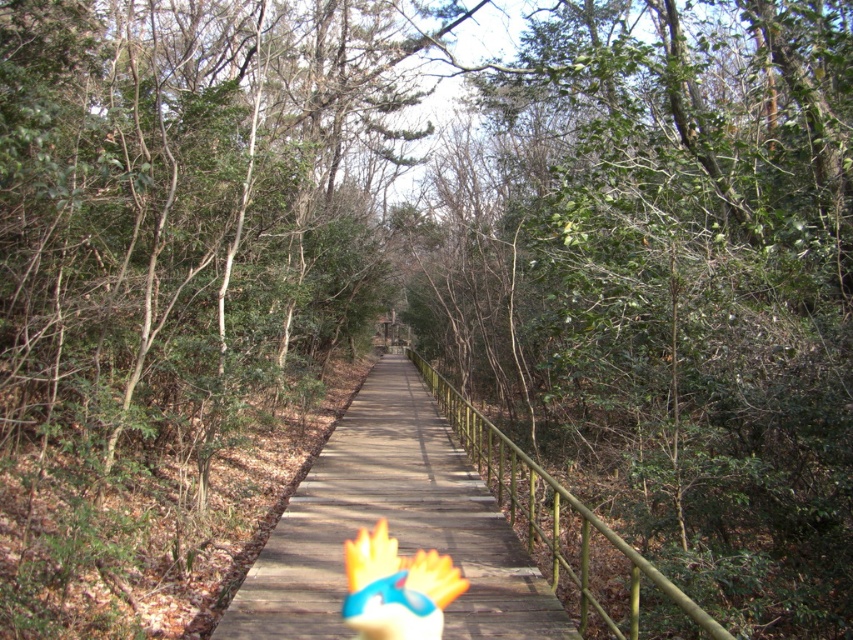
Question: Which object appears farthest from the camera in this image?

Choices:
 (A) wooden boardwalk at center
 (B) flame-patterned plastic toy at center

Answer: (A)

Question: Is wooden boardwalk at center smaller than flame-patterned plastic toy at center?

Choices:
 (A) yes
 (B) no

Answer: (B)

Question: Among these objects, which one is nearest to the camera?

Choices:
 (A) flame-patterned plastic toy at center
 (B) wooden boardwalk at center

Answer: (A)

Question: Among these points, which one is farthest from the camera?

Choices:
 (A) (405, 500)
 (B) (381, 563)

Answer: (A)

Question: Can you confirm if wooden boardwalk at center is positioned above flame-patterned plastic toy at center?

Choices:
 (A) yes
 (B) no

Answer: (B)

Question: Is wooden boardwalk at center positioned in front of flame-patterned plastic toy at center?

Choices:
 (A) yes
 (B) no

Answer: (B)